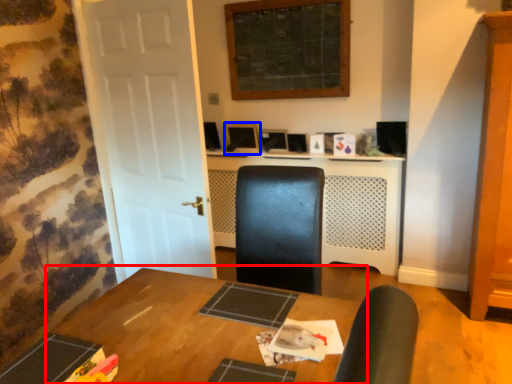
Question: Which of the following is the closest to the observer, table (highlighted by a red box) or computer monitor (highlighted by a blue box)?

Choices:
 (A) table
 (B) computer monitor

Answer: (A)